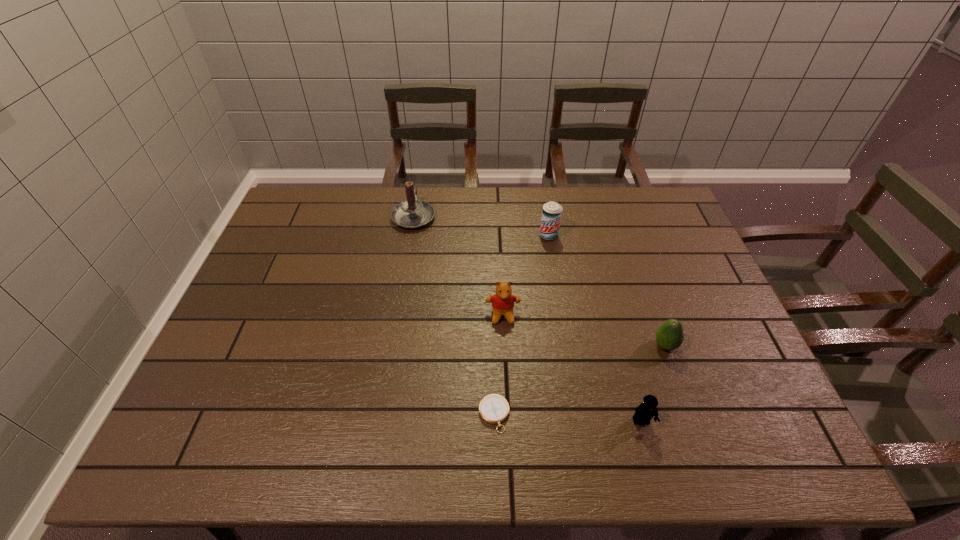
This screenshot has height=540, width=960. In order to click on the tallest object in this screenshot , I will do `click(412, 214)`.

I want to click on the leftmost object, so pos(412,214).

At what (x,y) coordinates should I click in order to perform the action: click on beer can. Please return your answer as a coordinate pair (x, y). The height and width of the screenshot is (540, 960). Looking at the image, I should click on (552, 211).

The height and width of the screenshot is (540, 960). In order to click on teddy bear in this screenshot , I will do `click(503, 301)`.

Locate an element on the screen. The width and height of the screenshot is (960, 540). the third nearest object is located at coordinates (669, 336).

Find the location of a particular element. This screenshot has width=960, height=540. avocado is located at coordinates (669, 336).

Image resolution: width=960 pixels, height=540 pixels. I want to click on Lego, so click(x=645, y=411).

This screenshot has height=540, width=960. In order to click on compass in this screenshot , I will do `click(494, 409)`.

Where is `vacant point located 0.060m on the back of the beer can`? The width and height of the screenshot is (960, 540). vacant point located 0.060m on the back of the beer can is located at coordinates (546, 218).

Where is `free location located 0.120m on the front-facing side of the fourth nearest object`? The width and height of the screenshot is (960, 540). free location located 0.120m on the front-facing side of the fourth nearest object is located at coordinates pyautogui.click(x=505, y=364).